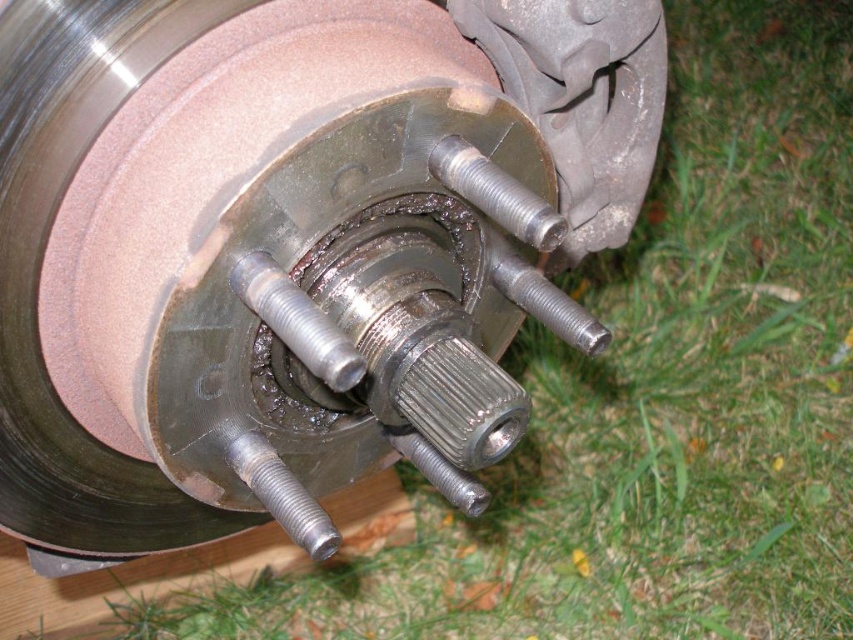
Does point (401, 58) come behind point (445, 141)?

Yes, point (401, 58) is farther from viewer.

Which is in front, point (238, 362) or point (453, 168)?

Point (238, 362)

Locate an element on the screen. This screenshot has width=853, height=640. metallic brake rotor at center is located at coordinates click(x=286, y=246).